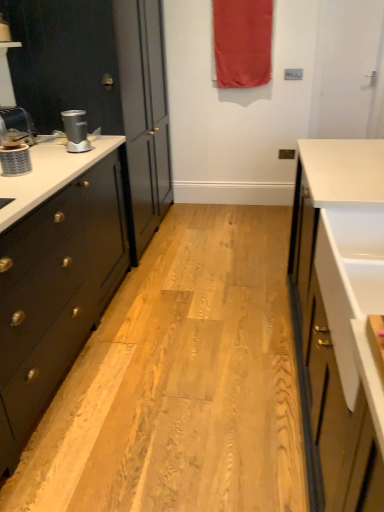
Question: Is brushed metal faucet at left far from matte silver blender at left?

Choices:
 (A) no
 (B) yes

Answer: (A)

Question: Is brushed metal faucet at left positioned with its back to matte silver blender at left?

Choices:
 (A) no
 (B) yes

Answer: (A)

Question: Is brushed metal faucet at left aimed at matte silver blender at left?

Choices:
 (A) yes
 (B) no

Answer: (B)

Question: From a real-world perspective, is brushed metal faucet at left positioned over matte silver blender at left based on gravity?

Choices:
 (A) no
 (B) yes

Answer: (B)

Question: Is brushed metal faucet at left wider than matte silver blender at left?

Choices:
 (A) yes
 (B) no

Answer: (A)

Question: From the image's perspective, is brushed metal faucet at left on matte silver blender at left?

Choices:
 (A) yes
 (B) no

Answer: (A)

Question: From a real-world perspective, is matte black cabinet at left below red fabric curtain at upper center?

Choices:
 (A) yes
 (B) no

Answer: (A)

Question: Is matte black cabinet at left at the right side of red fabric curtain at upper center?

Choices:
 (A) yes
 (B) no

Answer: (B)

Question: Can you confirm if matte black cabinet at left is shorter than red fabric curtain at upper center?

Choices:
 (A) no
 (B) yes

Answer: (A)

Question: Can you confirm if matte black cabinet at left is bigger than red fabric curtain at upper center?

Choices:
 (A) yes
 (B) no

Answer: (A)

Question: Would you say matte black cabinet at left contains red fabric curtain at upper center?

Choices:
 (A) no
 (B) yes

Answer: (A)

Question: From the image's perspective, is matte black cabinet at left on top of red fabric curtain at upper center?

Choices:
 (A) no
 (B) yes

Answer: (A)

Question: From the image's perspective, is silver metallic coffee machine at left on red fabric curtain at upper center?

Choices:
 (A) yes
 (B) no

Answer: (B)